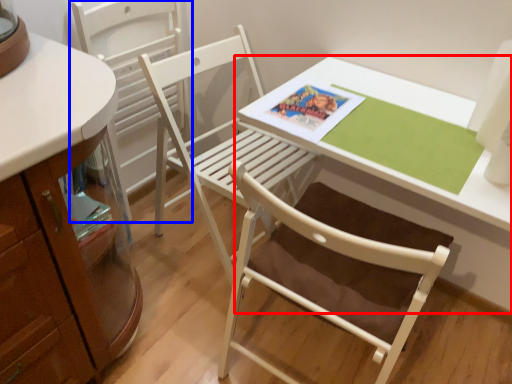
Question: Which of the following is the closest to the observer, table (highlighted by a red box) or chair (highlighted by a blue box)?

Choices:
 (A) table
 (B) chair

Answer: (A)